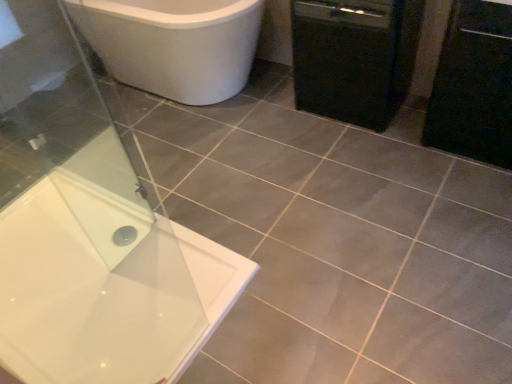
Question: Could you tell me if white glossy bathtub at upper left is turned towards black matte cabinet at right?

Choices:
 (A) yes
 (B) no

Answer: (B)

Question: Considering the relative sizes of white glossy bathtub at upper left and black matte cabinet at right in the image provided, is white glossy bathtub at upper left smaller than black matte cabinet at right?

Choices:
 (A) yes
 (B) no

Answer: (A)

Question: Is black matte cabinet at right completely or partially inside white glossy bathtub at upper left?

Choices:
 (A) yes
 (B) no

Answer: (B)

Question: Can you confirm if white glossy bathtub at upper left is taller than black matte cabinet at right?

Choices:
 (A) yes
 (B) no

Answer: (A)

Question: Can you confirm if white glossy bathtub at upper left is thinner than black matte cabinet at right?

Choices:
 (A) yes
 (B) no

Answer: (A)

Question: Is white glossy bathtub at upper left turned away from black matte cabinet at right?

Choices:
 (A) no
 (B) yes

Answer: (A)

Question: From the image's perspective, is black matte dishwasher at right located beneath transparent glass screen door at lower left?

Choices:
 (A) no
 (B) yes

Answer: (A)

Question: Is black matte dishwasher at right positioned before transparent glass screen door at lower left?

Choices:
 (A) yes
 (B) no

Answer: (B)

Question: Can you confirm if black matte dishwasher at right is positioned to the left of transparent glass screen door at lower left?

Choices:
 (A) no
 (B) yes

Answer: (A)

Question: Is black matte dishwasher at right located outside transparent glass screen door at lower left?

Choices:
 (A) no
 (B) yes

Answer: (B)

Question: Is the depth of black matte dishwasher at right greater than that of transparent glass screen door at lower left?

Choices:
 (A) no
 (B) yes

Answer: (B)

Question: From the image's perspective, does black matte dishwasher at right appear higher than transparent glass screen door at lower left?

Choices:
 (A) no
 (B) yes

Answer: (B)

Question: From the image's perspective, is white glossy bathtub at upper left beneath transparent glass screen door at lower left?

Choices:
 (A) yes
 (B) no

Answer: (A)